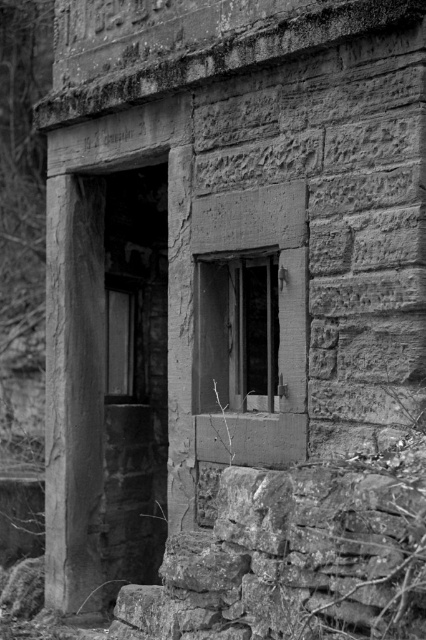
You are an architect examining the stone structure. You notice the wooden frame at center and the smooth glass window at center. Which object is shorter in height?

The wooden frame at center has a lesser height compared to the smooth glass window at center, so the wooden frame at center is shorter in height.